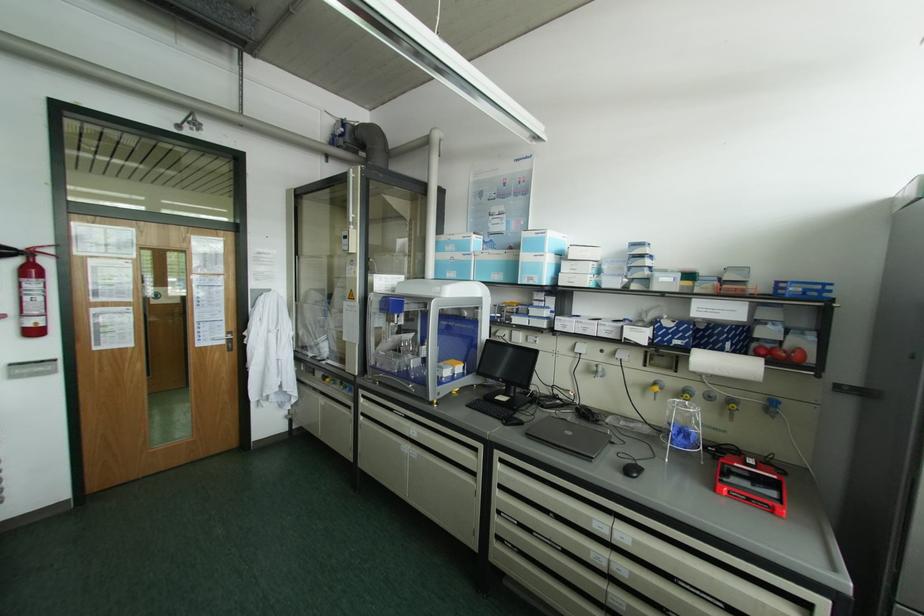
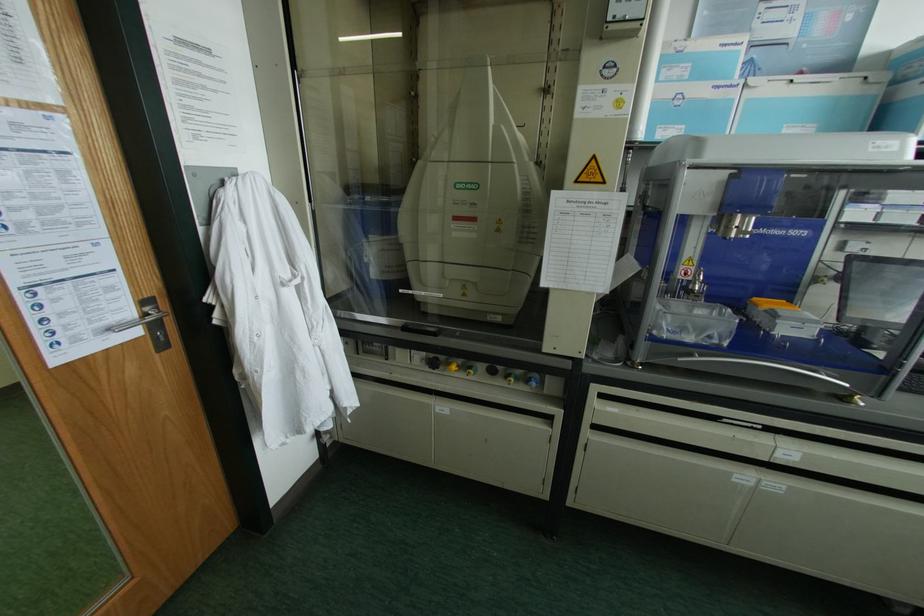
What movement of the cameraman would produce the second image?

The cameraman walked toward left, forward.